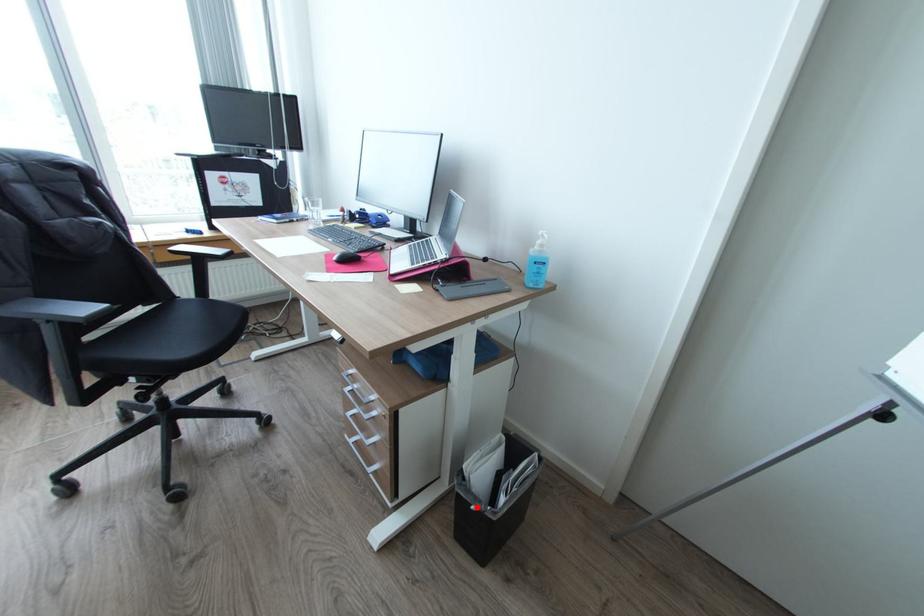
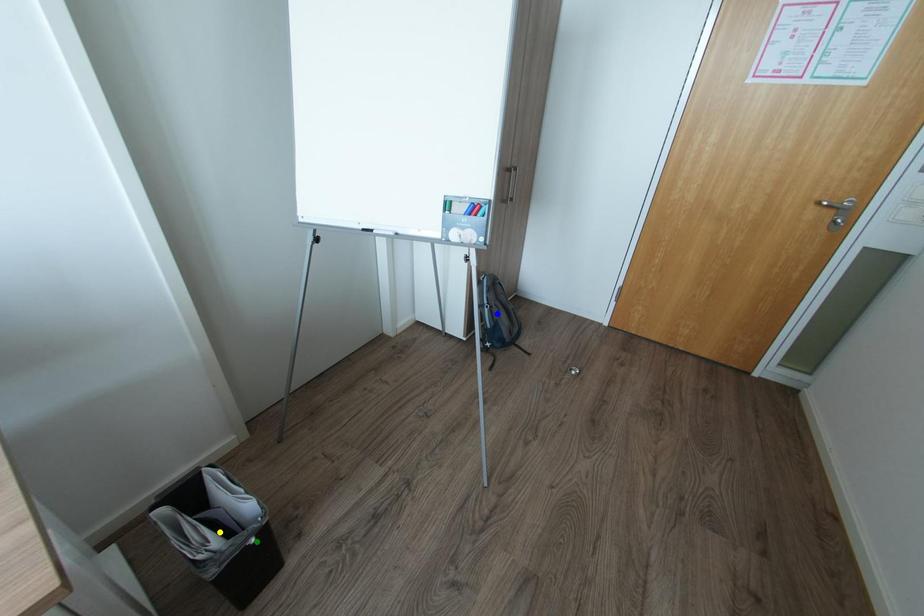
Question: I am providing you with two images of the same scene from different viewpoints. A red point is marked on the first image. You are given multiple points on the second image. Can you choose the point in image 2 that corresponds to the point in image 1?

Choices:
 (A) blue point
 (B) yellow point
 (C) green point

Answer: (C)